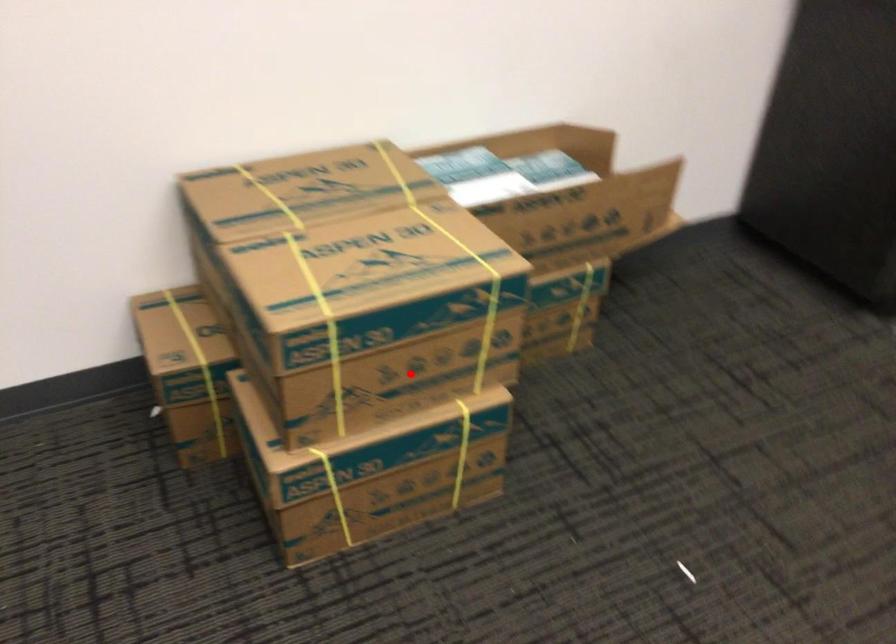
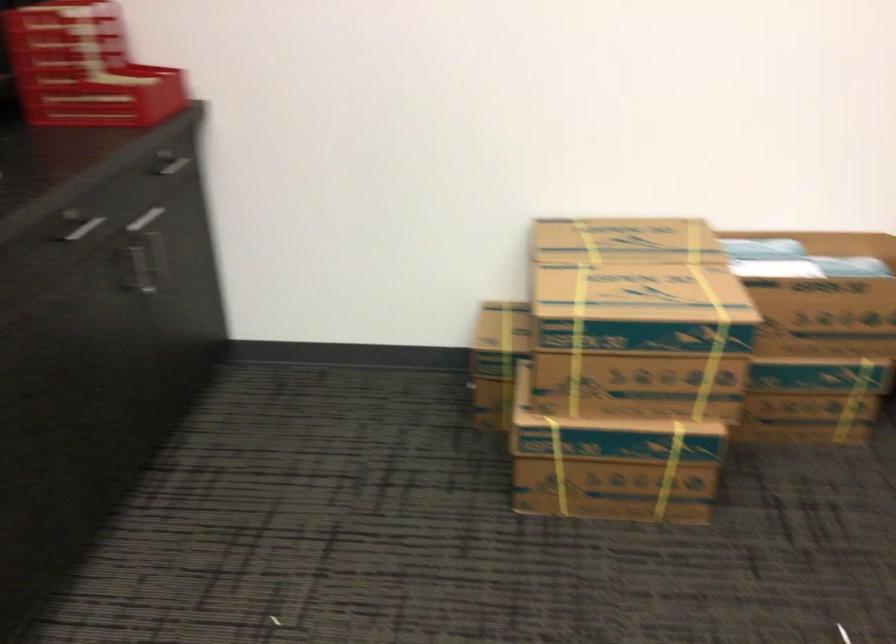
Question: I am providing you with two images of the same scene from different viewpoints. A red point is shown in image1. For the corresponding object point in image2, is it positioned nearer or farther from the camera?

Choices:
 (A) Nearer
 (B) Farther

Answer: (B)